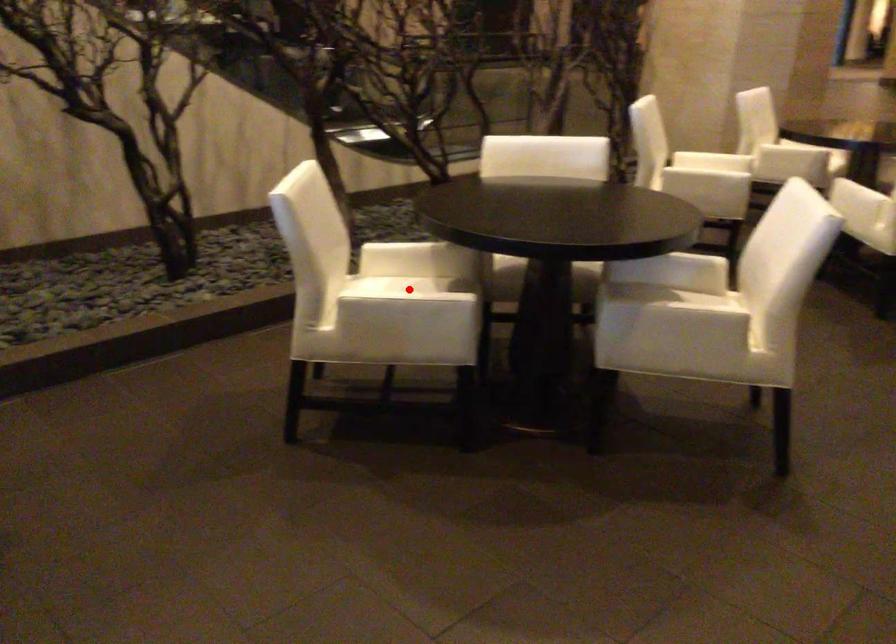
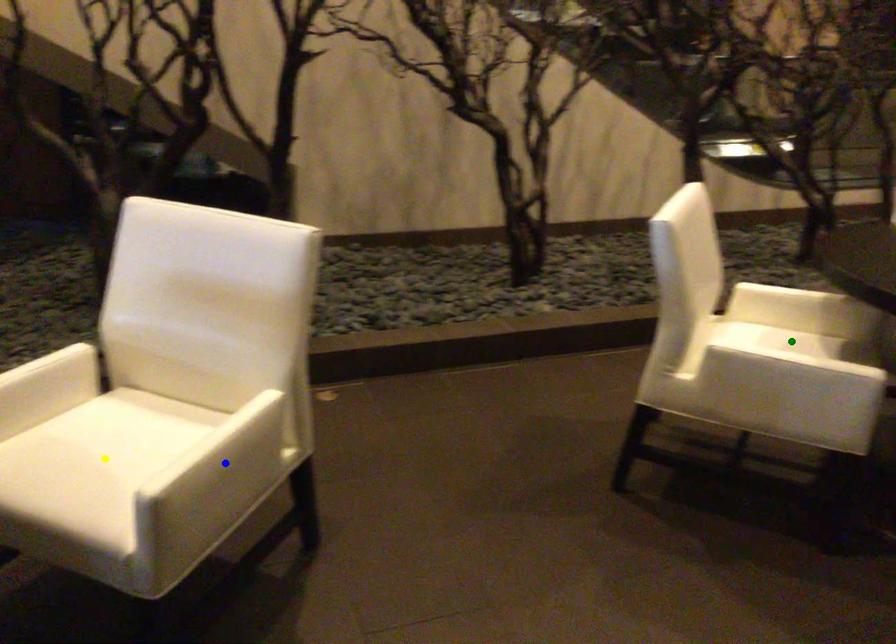
Question: I am providing you with two images of the same scene from different viewpoints. A red point is marked on the first image. You are given multiple points on the second image. Which point in image 2 is actually the same real-world point as the red point in image 1?

Choices:
 (A) yellow point
 (B) blue point
 (C) green point

Answer: (C)